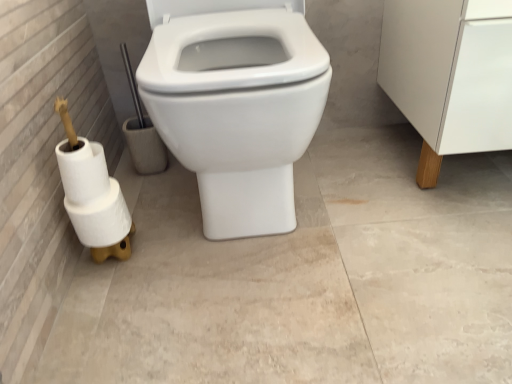
Find the location of a particular element. Image resolution: width=512 pixels, height=384 pixels. vacant space in between white glossy toilet at center and white matte toilet paper at left, which ranks as the second toilet paper in bottom-to-top order is located at coordinates (153, 215).